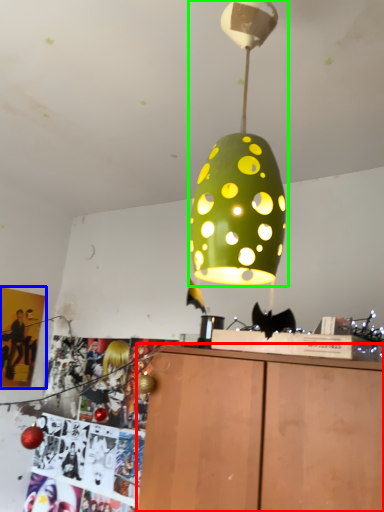
Question: Estimate the real-world distances between objects in this image. Which object is closer to furniture (highlighted by a red box), poster page (highlighted by a blue box) or lamp (highlighted by a green box)?

Choices:
 (A) poster page
 (B) lamp

Answer: (B)